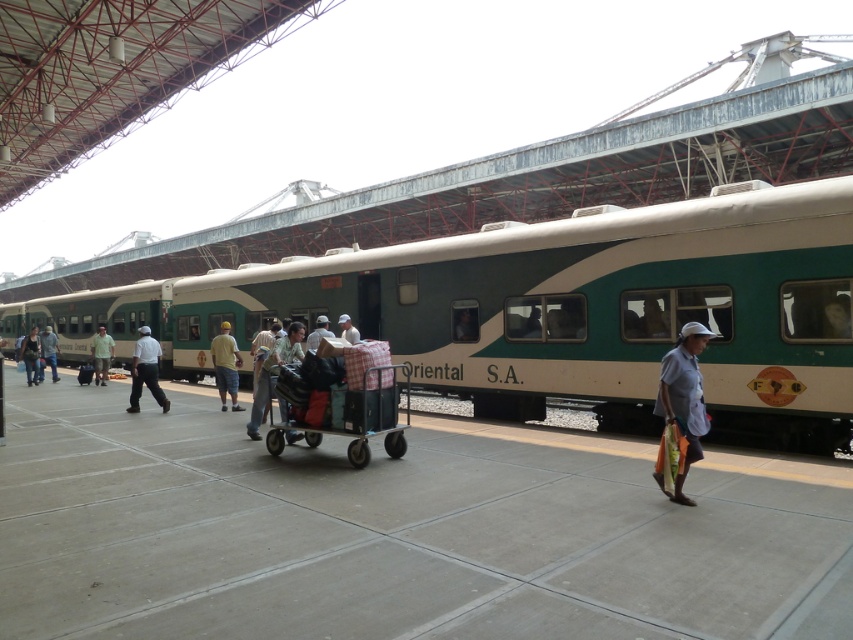
Question: Estimate the real-world distances between objects in this image. Which object is farther from the green fabric shirt at left?

Choices:
 (A) dark green fabric bag at center
 (B) denim pants at left
 (C) matte white shirt at center
 (D) light brown fabric shirt at center

Answer: (D)

Question: Is white matte shirt at center positioned at the back of light brown fabric shirt at center?

Choices:
 (A) no
 (B) yes

Answer: (B)

Question: Which point is closer to the camera?

Choices:
 (A) white matte shirt at center
 (B) light blue shirt at center
 (C) yellow cotton shirt at center

Answer: (B)

Question: Is white cotton shirt at center above light brown fabric pants at center?

Choices:
 (A) yes
 (B) no

Answer: (A)

Question: Which point appears farthest from the camera in this image?

Choices:
 (A) (317, 326)
 (B) (672, 499)
 (C) (454, 316)

Answer: (A)

Question: Does plastic luggage cart at center appear over yellow cotton shirt at center?

Choices:
 (A) no
 (B) yes

Answer: (A)